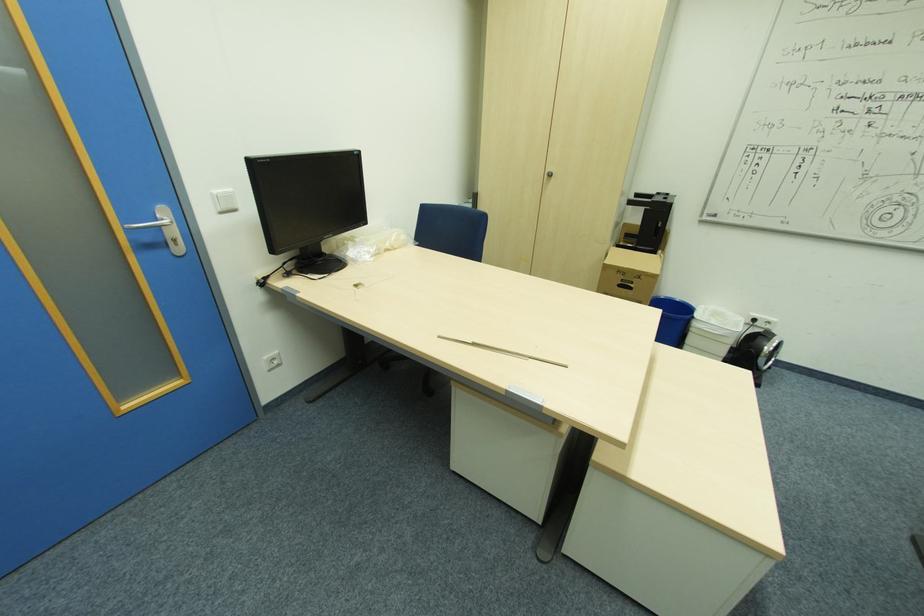
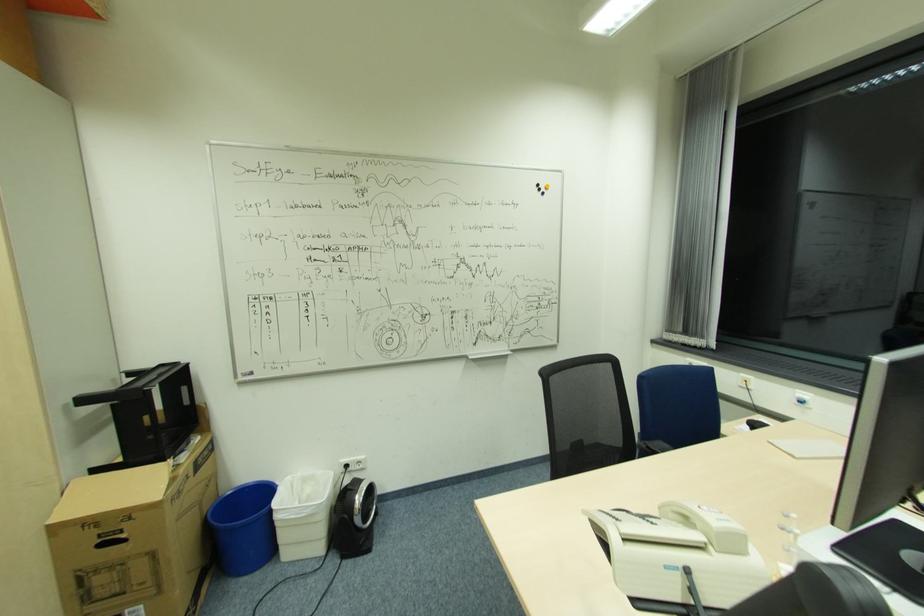
In the second image, find the point that corresponds to (x=609, y=262) in the first image.

(51, 522)